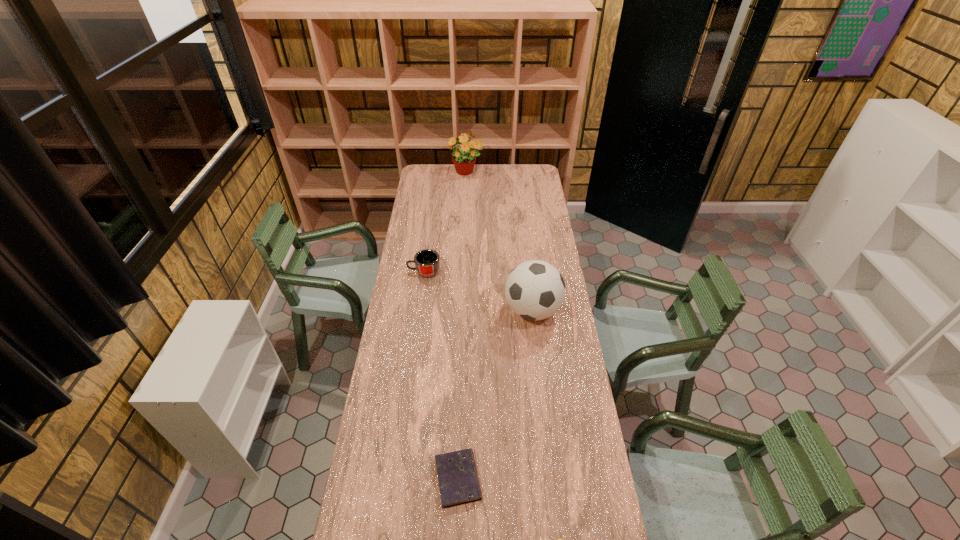
Where is `object present at the left edge`? The height and width of the screenshot is (540, 960). object present at the left edge is located at coordinates (427, 261).

Identify the location of object that is at the right edge. (535, 290).

Locate an element on the screen. This screenshot has width=960, height=540. vacant space at the far edge of the desktop is located at coordinates (487, 167).

Where is `free space at the left edge`? The width and height of the screenshot is (960, 540). free space at the left edge is located at coordinates (410, 265).

Find the location of `free point at the right edge`. free point at the right edge is located at coordinates (555, 242).

Find the location of `free point at the far right corner`. free point at the far right corner is located at coordinates (525, 170).

Find the location of a particular element. The width and height of the screenshot is (960, 540). unoccupied position between the third nearest object and the third shortest object is located at coordinates (478, 291).

Find the location of a particular element. The width and height of the screenshot is (960, 540). free spot between the third tallest object and the diary is located at coordinates (441, 375).

I want to click on free spot between the mug and the diary, so click(x=441, y=375).

You are a GUI agent. You are given a task and a screenshot of the screen. Output one action in this format:
    pyautogui.click(x=<x>, y=<y>)
    Task: Click on the free spot between the third farthest object and the third shortest object
    
    Given the screenshot: What is the action you would take?
    click(478, 291)